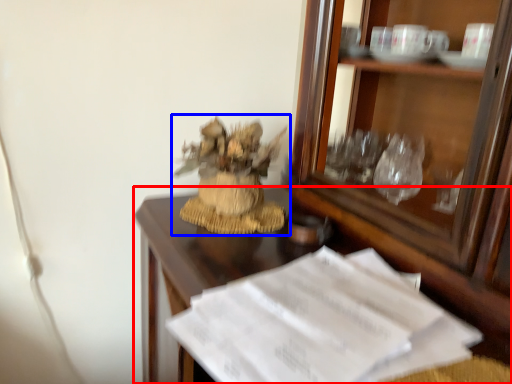
Question: Which of the following is the farthest to the observer, desk (highlighted by a red box) or houseplant (highlighted by a blue box)?

Choices:
 (A) desk
 (B) houseplant

Answer: (B)